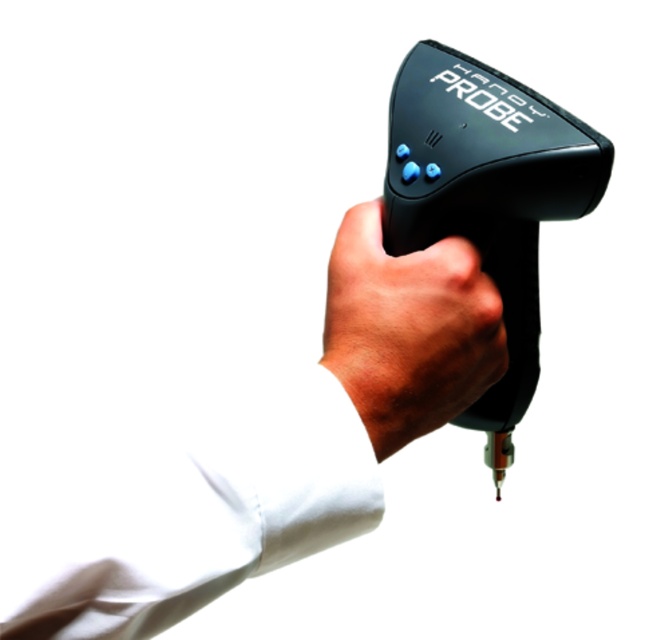
Between black matte probe at center and matte black probe at center, which one appears on the left side from the viewer's perspective?

From the viewer's perspective, black matte probe at center appears more on the left side.

Does black matte probe at center have a greater height compared to matte black probe at center?

Yes, black matte probe at center is taller than matte black probe at center.

Who is more distant from viewer, (74, 509) or (389, 378)?

The point (389, 378) is behind.

Image resolution: width=669 pixels, height=640 pixels. I want to click on black matte probe at center, so tap(258, 456).

Which is more to the right, black rubber probe at center or matte black probe at center?

From the viewer's perspective, black rubber probe at center appears more on the right side.

Who is more distant from viewer, (x=597, y=200) or (x=446, y=387)?

The point (x=597, y=200) is more distant.

I want to click on black rubber probe at center, so click(486, 196).

Identify the location of black rubber probe at center. Image resolution: width=669 pixels, height=640 pixels. (486, 196).

Which of these two, black matte probe at center or black rubber probe at center, stands taller?

black rubber probe at center

Which is below, black matte probe at center or black rubber probe at center?

black matte probe at center

Measure the distance between point (169, 552) and camera.

A distance of 12.64 inches exists between point (169, 552) and camera.

Identify the location of black matte probe at center. (258, 456).